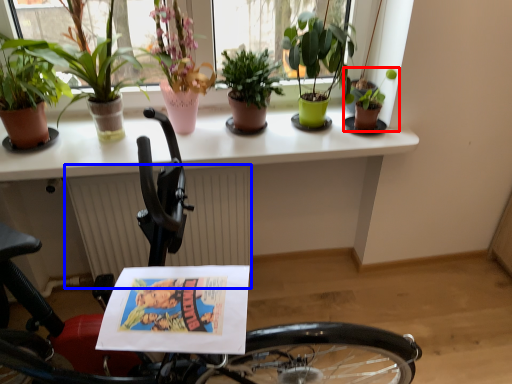
Question: Which point is further to the camera, houseplant (highlighted by a red box) or radiator (highlighted by a blue box)?

Choices:
 (A) houseplant
 (B) radiator

Answer: (B)